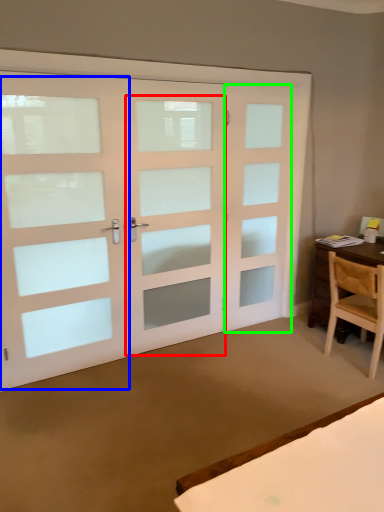
Question: Which object is positioned closest to screen door (highlighted by a red box)? Select from screen door (highlighted by a blue box) and screen door (highlighted by a green box).

Choices:
 (A) screen door
 (B) screen door

Answer: (B)